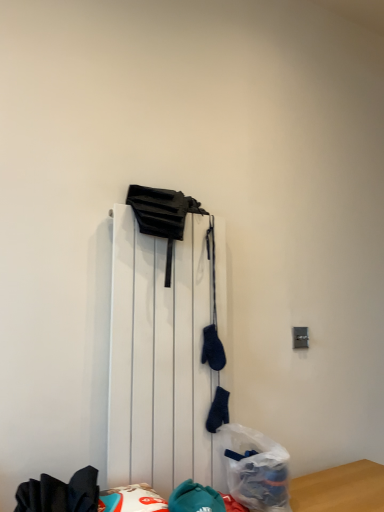
Where is `white matte radiator at center`? This screenshot has width=384, height=512. white matte radiator at center is located at coordinates [x=160, y=360].

Describe the element at coordinates (160, 360) in the screenshot. The width and height of the screenshot is (384, 512). I see `white matte radiator at center` at that location.

Measure the distance between translucent plastic bag at lower center and camera.

A distance of 1.34 meters exists between translucent plastic bag at lower center and camera.

The width and height of the screenshot is (384, 512). What do you see at coordinates (255, 468) in the screenshot?
I see `translucent plastic bag at lower center` at bounding box center [255, 468].

The image size is (384, 512). Identify the location of translucent plastic bag at lower center. (255, 468).

What are the coordinates of `white matte radiator at center` in the screenshot? It's located at (160, 360).

Considering the positions of objects translucent plastic bag at lower center and white matte radiator at center in the image provided, who is more to the left, translucent plastic bag at lower center or white matte radiator at center?

white matte radiator at center.

Is translucent plastic bag at lower center closer to the viewer compared to white matte radiator at center?

No, it is not.

Considering the positions of points (244, 479) and (112, 258), is point (244, 479) farther from camera compared to point (112, 258)?

No.

From the image's perspective, which is above, translucent plastic bag at lower center or white matte radiator at center?

white matte radiator at center appears higher in the image.

From a real-world perspective, who is located lower, translucent plastic bag at lower center or white matte radiator at center?

translucent plastic bag at lower center is physically lower.

Considering the sizes of objects translucent plastic bag at lower center and white matte radiator at center in the image provided, who is thinner, translucent plastic bag at lower center or white matte radiator at center?

With smaller width is white matte radiator at center.

Considering the relative sizes of translucent plastic bag at lower center and white matte radiator at center in the image provided, is translucent plastic bag at lower center shorter than white matte radiator at center?

Correct, translucent plastic bag at lower center is not as tall as white matte radiator at center.

Does translucent plastic bag at lower center have a smaller size compared to white matte radiator at center?

Yes, translucent plastic bag at lower center is smaller than white matte radiator at center.

Would you say translucent plastic bag at lower center contains white matte radiator at center?

Actually, white matte radiator at center is outside translucent plastic bag at lower center.

Can you see translucent plastic bag at lower center touching white matte radiator at center?

No, translucent plastic bag at lower center is not with white matte radiator at center.

Is translucent plastic bag at lower center turned away from white matte radiator at center?

Yes, white matte radiator at center is at the back of translucent plastic bag at lower center.

Where is `radiator located in front of the translucent plastic bag at lower center`? radiator located in front of the translucent plastic bag at lower center is located at coordinates (160, 360).

Based on the photo, which is more to the left, white matte radiator at center or translucent plastic bag at lower center?

Positioned to the left is white matte radiator at center.

Which object is more forward, white matte radiator at center or translucent plastic bag at lower center?

white matte radiator at center is more forward.

Does point (185, 230) come farther from viewer compared to point (248, 500)?

Yes, it is.

From the image's perspective, which is below, white matte radiator at center or translucent plastic bag at lower center?

translucent plastic bag at lower center is shown below in the image.

From a real-world perspective, who is located lower, white matte radiator at center or translucent plastic bag at lower center?

translucent plastic bag at lower center.

Which object is thinner, white matte radiator at center or translucent plastic bag at lower center?

white matte radiator at center.

Considering the sizes of objects white matte radiator at center and translucent plastic bag at lower center in the image provided, who is shorter, white matte radiator at center or translucent plastic bag at lower center?

translucent plastic bag at lower center.

Which of these two, white matte radiator at center or translucent plastic bag at lower center, is bigger?

With larger size is white matte radiator at center.

Is white matte radiator at center inside the boundaries of translucent plastic bag at lower center, or outside?

The correct answer is: outside.

Is white matte radiator at center far away from translucent plastic bag at lower center?

No.

Could you tell me if white matte radiator at center is turned towards translucent plastic bag at lower center?

Yes, white matte radiator at center is aimed at translucent plastic bag at lower center.

What's the angular difference between white matte radiator at center and translucent plastic bag at lower center's facing directions?

There is a 0.00181-degree angle between the facing directions of white matte radiator at center and translucent plastic bag at lower center.

Where is `radiator above the translucent plastic bag at lower center (from a real-world perspective)`? radiator above the translucent plastic bag at lower center (from a real-world perspective) is located at coordinates tap(160, 360).

At what (x,y) coordinates should I click in order to perform the action: click on plastic bag that is on the right side of white matte radiator at center. Please return your answer as a coordinate pair (x, y). This screenshot has height=512, width=384. Looking at the image, I should click on (255, 468).

At what (x,y) coordinates should I click in order to perform the action: click on plastic bag located below the white matte radiator at center (from the image's perspective). Please return your answer as a coordinate pair (x, y). The image size is (384, 512). Looking at the image, I should click on (255, 468).